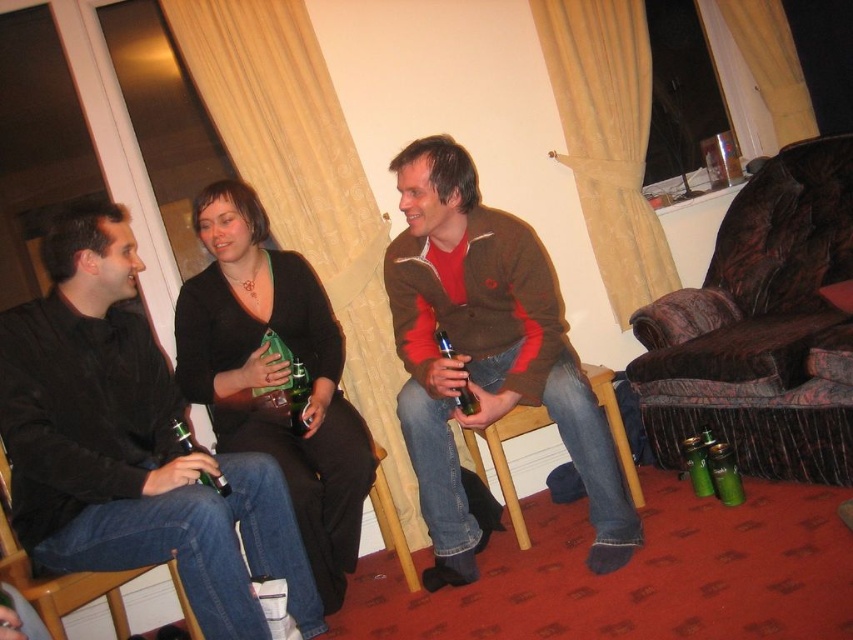
The width and height of the screenshot is (853, 640). Describe the element at coordinates (274, 374) in the screenshot. I see `matte black sweater at center` at that location.

Can you confirm if matte black sweater at center is positioned above green glass bottle at center?

Yes, matte black sweater at center is above green glass bottle at center.

Between point (219, 298) and point (293, 362), which one is positioned behind?

The point (219, 298) is more distant.

Where is `matte black sweater at center`? matte black sweater at center is located at coordinates (274, 374).

Can you confirm if velvet-patterned armchair at right is smaller than matte glass bottle at center?

Incorrect, velvet-patterned armchair at right is not smaller in size than matte glass bottle at center.

Measure the distance between velvet-patterned armchair at right and camera.

A distance of 6.58 feet exists between velvet-patterned armchair at right and camera.

Measure the distance between velvet-patterned armchair at right and camera.

They are 6.58 feet apart.

At what (x,y) coordinates should I click in order to perform the action: click on velvet-patterned armchair at right. Please return your answer as a coordinate pair (x, y). The width and height of the screenshot is (853, 640). Looking at the image, I should click on (762, 328).

Which of these two, green glass bottle at lower left or matte glass bottle at center, stands taller?

Standing taller between the two is matte glass bottle at center.

Between green glass bottle at lower left and matte glass bottle at center, which one has less height?

green glass bottle at lower left is shorter.

Is point (190, 449) positioned behind point (473, 403)?

No.

At what (x,y) coordinates should I click in order to perform the action: click on green glass bottle at lower left. Please return your answer as a coordinate pair (x, y). Looking at the image, I should click on (184, 436).